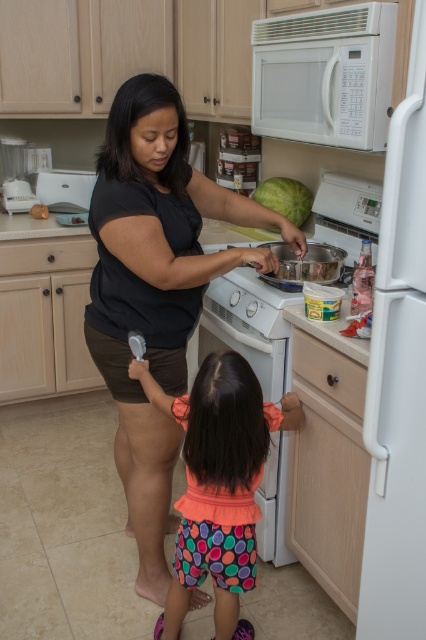
Question: Based on their relative distances, which object is farther from the multicolored fabric shorts at lower center?

Choices:
 (A) white matte microwave at upper center
 (B) black matte shirt at center
 (C) white plastic blender at left
 (D) green matte watermelon at upper center

Answer: (C)

Question: Is black matte shirt at center positioned behind green matte watermelon at upper center?

Choices:
 (A) no
 (B) yes

Answer: (A)

Question: Is black matte shirt at center in front of multicolored fabric shorts at lower center?

Choices:
 (A) yes
 (B) no

Answer: (B)

Question: Among these points, which one is nearest to the camera?

Choices:
 (A) (285, 200)
 (B) (146, 525)
 (C) (291, 17)
 (D) (245, 406)

Answer: (D)

Question: Does white matte microwave at upper center have a smaller size compared to white plastic blender at left?

Choices:
 (A) yes
 (B) no

Answer: (B)

Question: Estimate the real-world distances between objects in this image. Which object is closer to the black matte shirt at center?

Choices:
 (A) white plastic blender at left
 (B) white matte microwave at upper center
 (C) multicolored fabric shorts at lower center

Answer: (C)